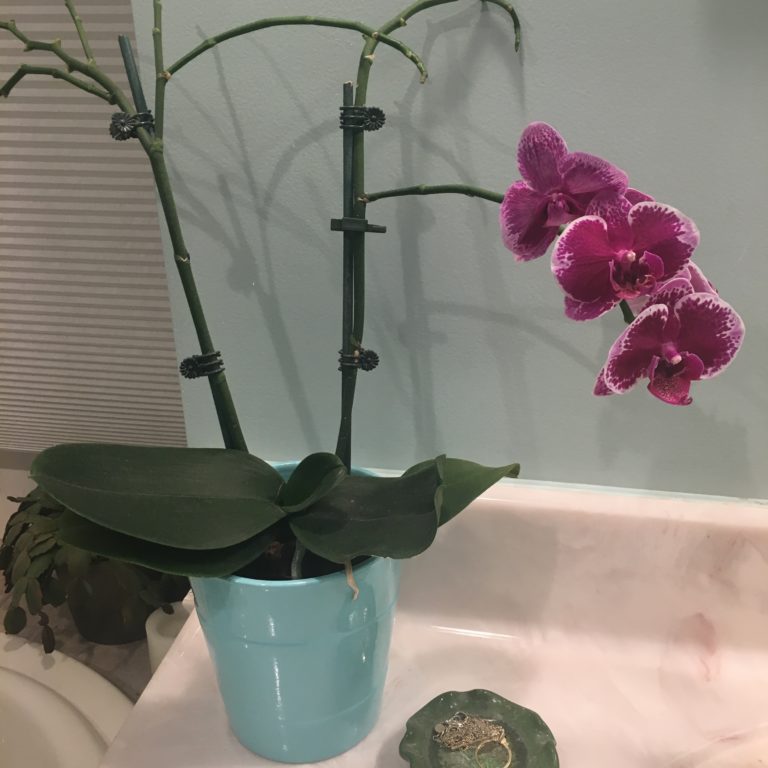
You are a GUI agent. You are given a task and a screenshot of the screen. Output one action in this format:
    pyautogui.click(x=<x>, y=<y>)
    Task: Click on the wall
    This screenshot has width=768, height=768.
    Given the screenshot: What is the action you would take?
    pyautogui.click(x=449, y=333)